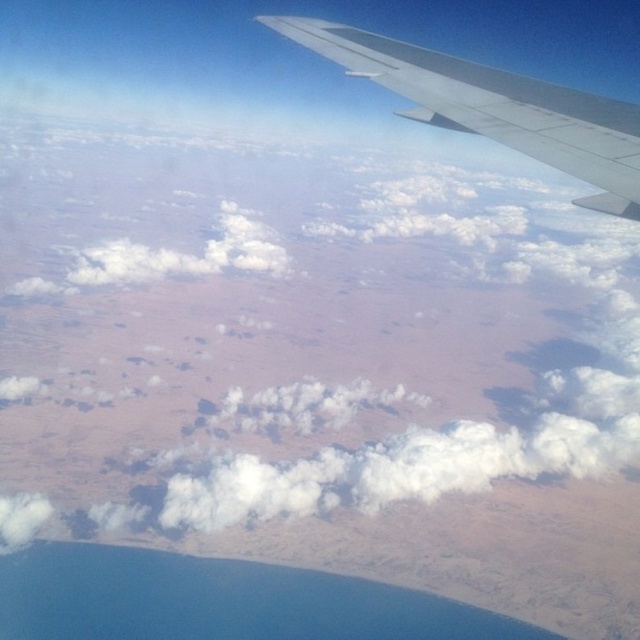
Question: Which of the following is the closest to the observer?

Choices:
 (A) (19, 476)
 (B) (566, 147)
 (C) (99, 563)

Answer: (B)

Question: Which object appears farthest from the camera in this image?

Choices:
 (A) white fluffy cloud at upper center
 (B) smooth gray wing at upper right
 (C) blue liquid water at bottom

Answer: (A)

Question: Which object is positioned farthest from the blue liquid water at bottom?

Choices:
 (A) smooth gray wing at upper right
 (B) white fluffy cloud at upper center

Answer: (A)

Question: Can you confirm if white fluffy cloud at upper center is positioned below blue liquid water at bottom?

Choices:
 (A) no
 (B) yes

Answer: (A)

Question: Is blue liquid water at bottom bigger than smooth gray wing at upper right?

Choices:
 (A) yes
 (B) no

Answer: (A)

Question: From the image, what is the correct spatial relationship of blue liquid water at bottom in relation to smooth gray wing at upper right?

Choices:
 (A) left
 (B) right

Answer: (A)